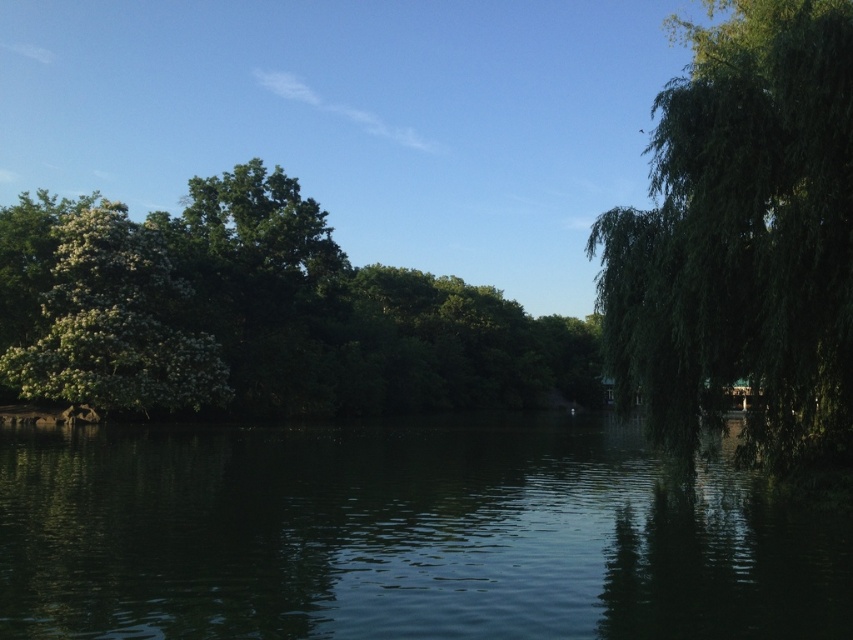
You are standing at the edge of the water in the scene. If you want to reach the green smooth water at center, which direction should you move towards?

Since the green smooth water at center is located at point 0.839 on the x axis and 0.471 on the y axis, you should move towards the center of the image to reach it.

You are standing at the center of the image. Which direction should you walk to reach the green leafy tree at right?

The green leafy tree at right is located at point coordinates of 0.372 on the x axis and 0.871 on the y axis. Since you are at the center, you should walk towards the right side of the image to reach it.